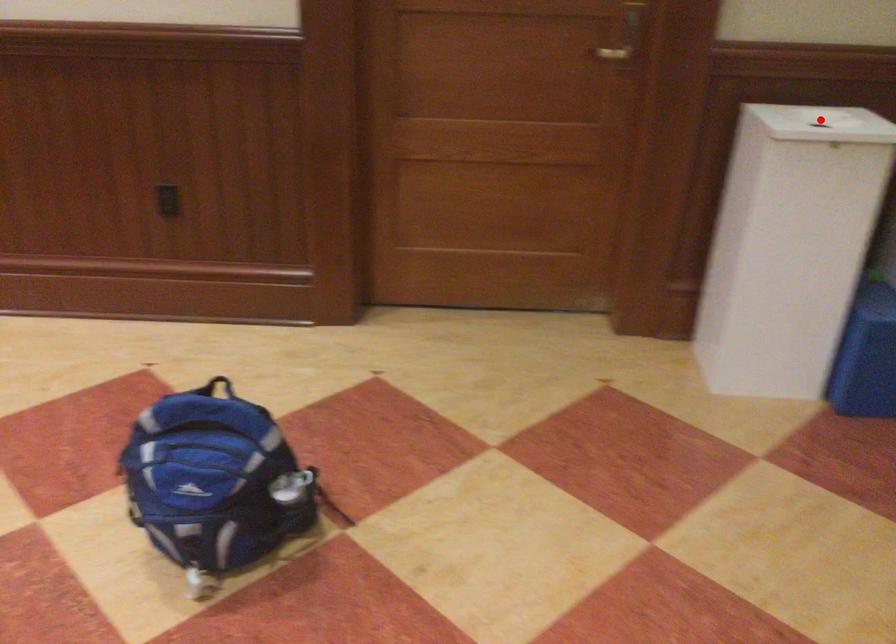
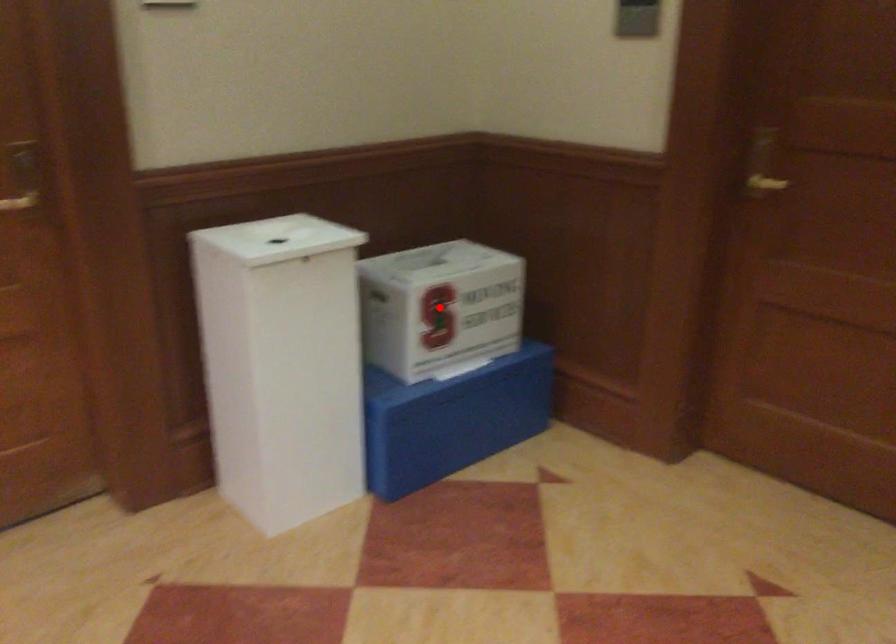
I am providing you with two images of the same scene from different viewpoints. A red point is marked on the first image and another point is marked on the second image. Is the red point in image1 aligned with the point shown in image2?

No